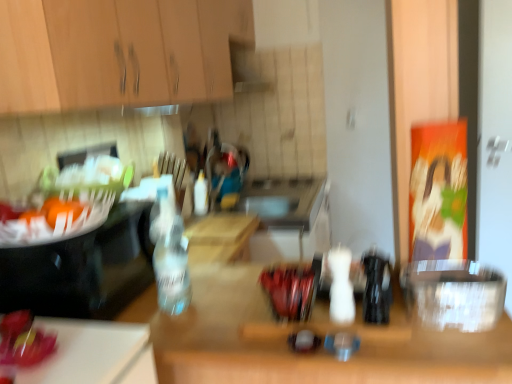
Identify the location of vacant space in between transparent plastic container at right, which is the first appliance from right to left, and black plastic bottle at center, which ranks as the first bottle in right-to-left order. (408, 317).